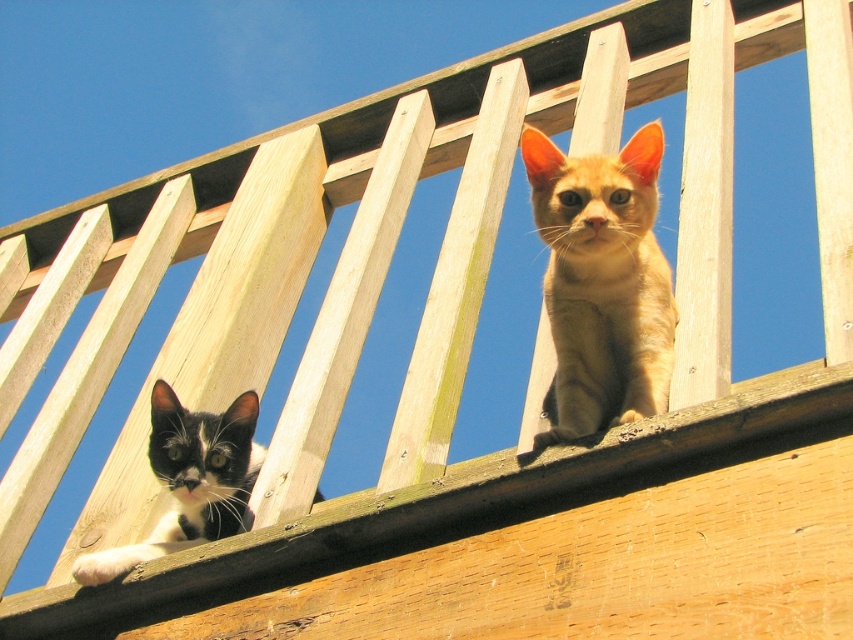
Question: Which point is closer to the camera taking this photo?

Choices:
 (A) (648, 317)
 (B) (184, 408)

Answer: (A)

Question: Is golden fur cat at upper right below black and white fur cat at lower left?

Choices:
 (A) yes
 (B) no

Answer: (B)

Question: Can you confirm if golden fur cat at upper right is bigger than black and white fur cat at lower left?

Choices:
 (A) no
 (B) yes

Answer: (B)

Question: Which point appears farthest from the camera in this image?

Choices:
 (A) (233, 452)
 (B) (599, 288)

Answer: (A)

Question: Considering the relative positions of golden fur cat at upper right and black and white fur cat at lower left in the image provided, where is golden fur cat at upper right located with respect to black and white fur cat at lower left?

Choices:
 (A) left
 (B) right

Answer: (B)